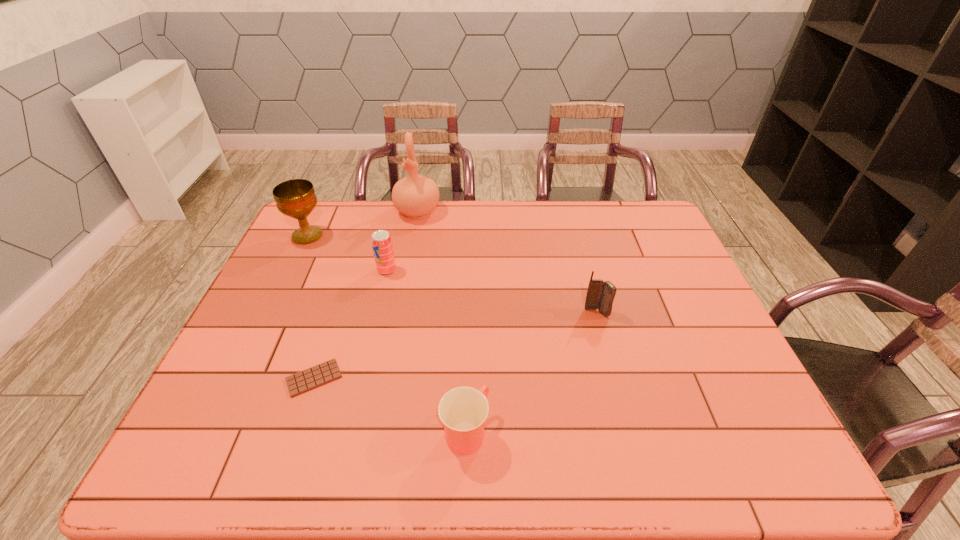
Locate an element on the screen. The height and width of the screenshot is (540, 960). empty space between the soda can and the fourth farthest object is located at coordinates (492, 292).

I want to click on empty space between the soda can and the chalice, so click(348, 253).

Locate an element on the screen. free space between the third farthest object and the candy bar is located at coordinates (350, 324).

Identify the location of free space between the nearest object and the soda can. (426, 350).

Where is `vacant area that lies between the third farthest object and the nearest object`? This screenshot has width=960, height=540. vacant area that lies between the third farthest object and the nearest object is located at coordinates (x=426, y=350).

This screenshot has height=540, width=960. I want to click on free point between the leftmost object and the rightmost object, so click(x=452, y=274).

Image resolution: width=960 pixels, height=540 pixels. I want to click on object that stands as the second closest to the tallest object, so click(x=296, y=198).

Select which object is the third closest to the cup. Please provide its 2D coordinates. Your answer should be formatted as a tuple, i.e. [(x, y)], where the tuple contains the x and y coordinates of a point satisfying the conditions above.

[(381, 241)]

Identify the location of vacant point that satisfies the following two spatial constraints: 1. on the front side of the cup; 2. on the right side of the fourth nearest object. (348, 431).

The height and width of the screenshot is (540, 960). What are the coordinates of `free space that satisfies the following two spatial constraints: 1. on the spout of the pottery; 2. on the right side of the nearest object` in the screenshot? It's located at (376, 431).